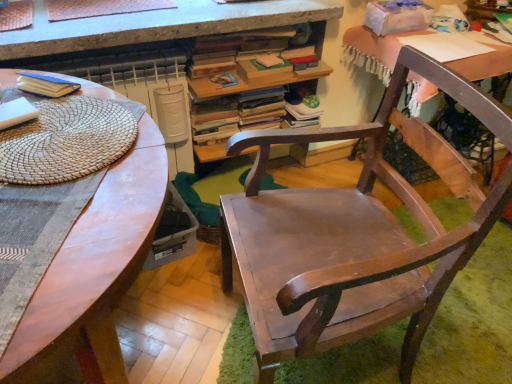
Image resolution: width=512 pixels, height=384 pixels. I want to click on free region under woven beige placemat at left (from a real-world perspective), so click(65, 135).